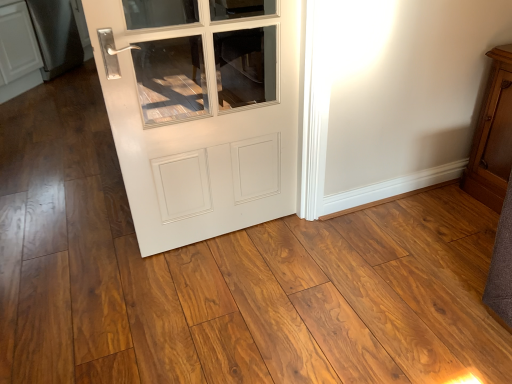
Identify the location of vacant space in front of white glossy door at center. (216, 322).